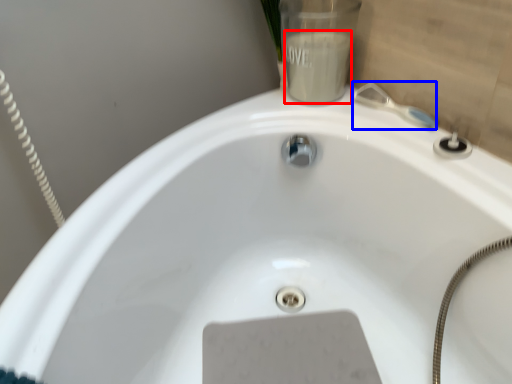
Question: Which of the following is the closest to the observer, liquid (highlighted by a red box) or plumbing fixture (highlighted by a blue box)?

Choices:
 (A) liquid
 (B) plumbing fixture

Answer: (B)